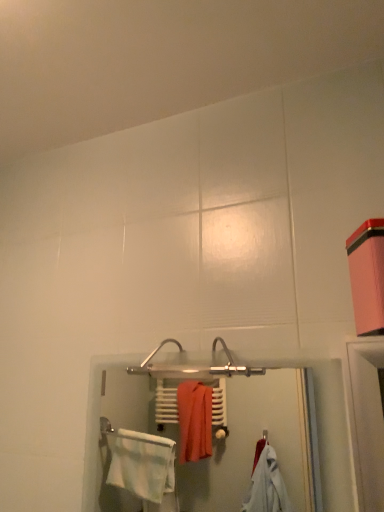
Measure the distance between point (125, 385) and camera.

Point (125, 385) and camera are 9.35 feet apart.

The width and height of the screenshot is (384, 512). What do you see at coordinates (207, 439) in the screenshot?
I see `white glossy towel rack at center` at bounding box center [207, 439].

Measure the distance between white glossy towel rack at center and camera.

The distance of white glossy towel rack at center from camera is 2.32 meters.

I want to click on white glossy towel rack at center, so click(207, 439).

Consider the image. In order to face white glossy towel rack at center, should I rotate leftwards or rightwards?

A 1.245 degree turn to the right will do.

Find the location of a particular element. This screenshot has height=512, width=384. white glossy towel rack at center is located at coordinates (207, 439).